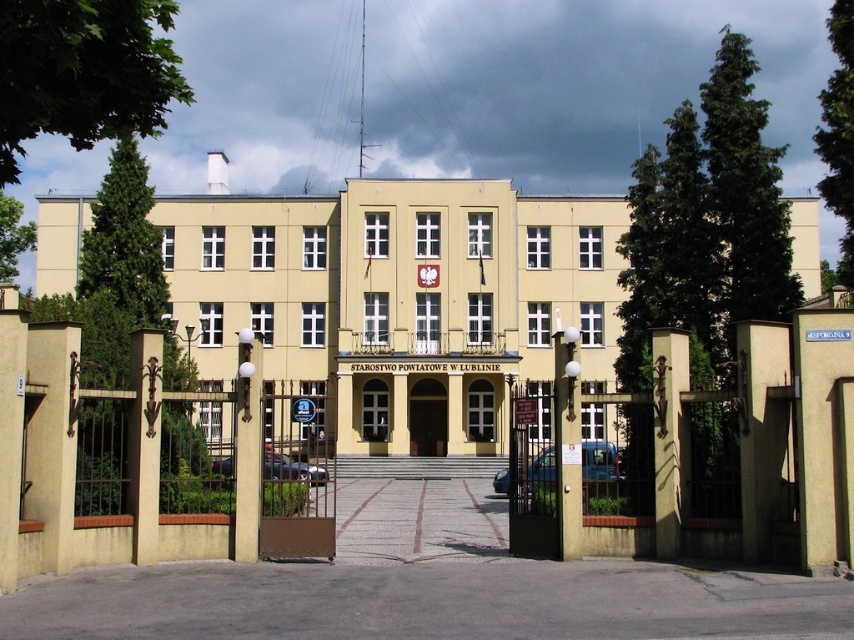
Question: In this image, where is beige concrete building at center located relative to brown wooden door at center?

Choices:
 (A) below
 (B) above

Answer: (B)

Question: Can you confirm if beige concrete building at center is positioned above brown wooden door at center?

Choices:
 (A) no
 (B) yes

Answer: (B)

Question: Does beige concrete building at center come in front of brown wooden door at center?

Choices:
 (A) yes
 (B) no

Answer: (A)

Question: Among these points, which one is farthest from the camera?

Choices:
 (A) (418, 396)
 (B) (401, 244)

Answer: (B)